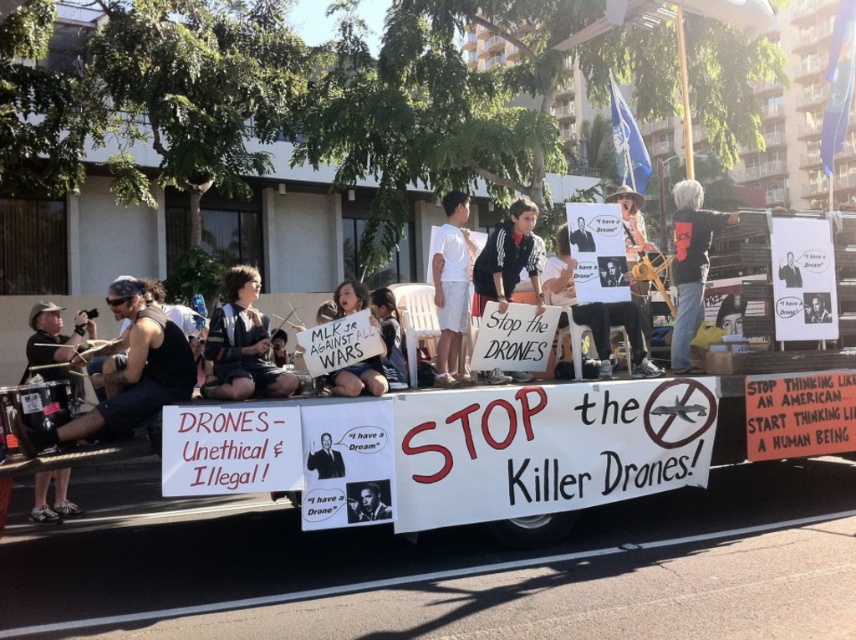
Is matte black drum set at left below white paper sign at center?

Yes, matte black drum set at left is below white paper sign at center.

Is point (55, 360) positioned in front of point (604, 342)?

Yes, point (55, 360) is in front of point (604, 342).

Image resolution: width=856 pixels, height=640 pixels. In order to click on matte black drum set at left in this screenshot , I will do `click(55, 342)`.

You are a GUI agent. You are given a task and a screenshot of the screen. Output one action in this format:
    pyautogui.click(x=<x>, y=<y>)
    Task: Click on the matte black drum set at left
    
    Given the screenshot: What is the action you would take?
    pyautogui.click(x=55, y=342)

Consider the image. Can you confirm if dark blue uniform at center is positioned above black adidas tracksuit at center?

Incorrect, dark blue uniform at center is not positioned above black adidas tracksuit at center.

Which is behind, point (230, 317) or point (521, 372)?

The point (521, 372) is more distant.

Who is more distant from viewer, (239, 356) or (498, 275)?

Point (498, 275)

Where is `dark blue uniform at center`? dark blue uniform at center is located at coordinates (242, 344).

Is matte black drum set at left closer to the viewer compared to smooth black suit at center?

No, it is not.

Does matte black drum set at left have a greater width compared to smooth black suit at center?

Indeed, matte black drum set at left has a greater width compared to smooth black suit at center.

The height and width of the screenshot is (640, 856). Describe the element at coordinates (55, 342) in the screenshot. I see `matte black drum set at left` at that location.

This screenshot has width=856, height=640. Identify the location of matte black drum set at left. (55, 342).